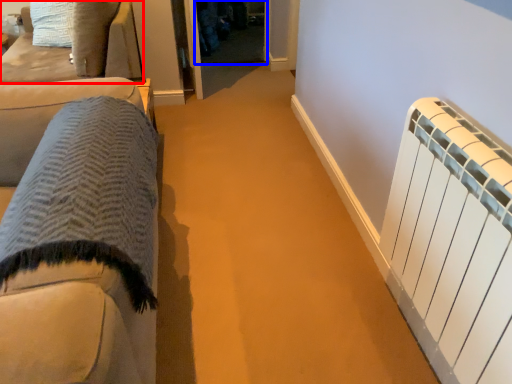
Question: Which object is further to the camera taking this photo, furniture (highlighted by a red box) or glass door (highlighted by a blue box)?

Choices:
 (A) furniture
 (B) glass door

Answer: (B)